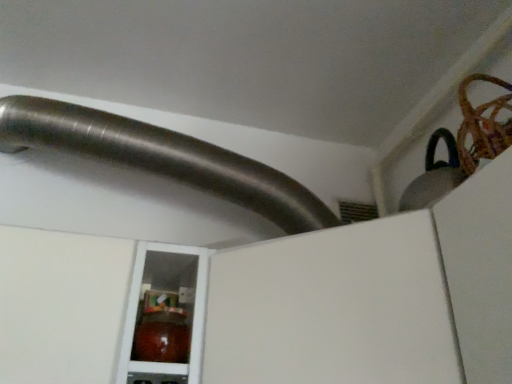
This screenshot has height=384, width=512. I want to click on metallic silver pipe at upper left, so click(x=162, y=158).

What do you see at coordinates (162, 158) in the screenshot? I see `metallic silver pipe at upper left` at bounding box center [162, 158].

Find the location of a particular element. metallic silver pipe at upper left is located at coordinates (162, 158).